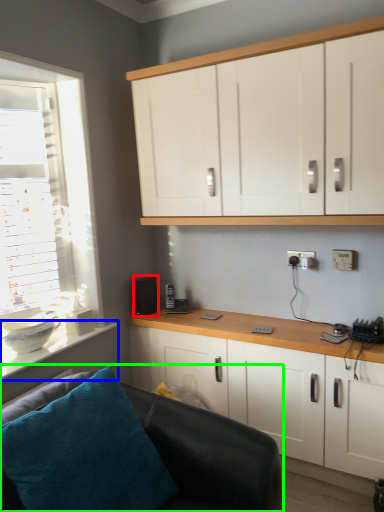
Question: Which is nearer to the speaker (highlighted by a red box)? counter top (highlighted by a blue box) or studio couch (highlighted by a green box).

Choices:
 (A) counter top
 (B) studio couch

Answer: (A)